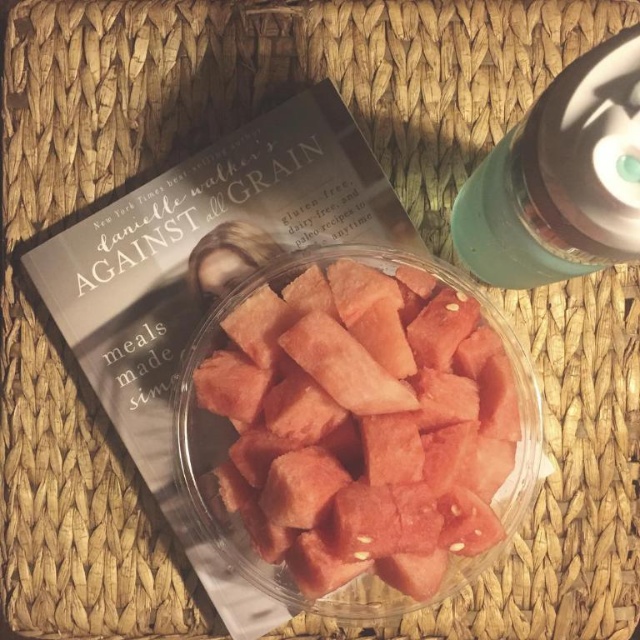
Question: Is pink juicy watermelon at center thinner than green matte bottle at upper right?

Choices:
 (A) no
 (B) yes

Answer: (A)

Question: Can you confirm if pink juicy watermelon at center is bigger than green matte bottle at upper right?

Choices:
 (A) yes
 (B) no

Answer: (B)

Question: Does pink juicy watermelon at center have a greater width compared to green matte bottle at upper right?

Choices:
 (A) yes
 (B) no

Answer: (A)

Question: Which object appears farthest from the camera in this image?

Choices:
 (A) green matte bottle at upper right
 (B) pink juicy watermelon at center

Answer: (B)